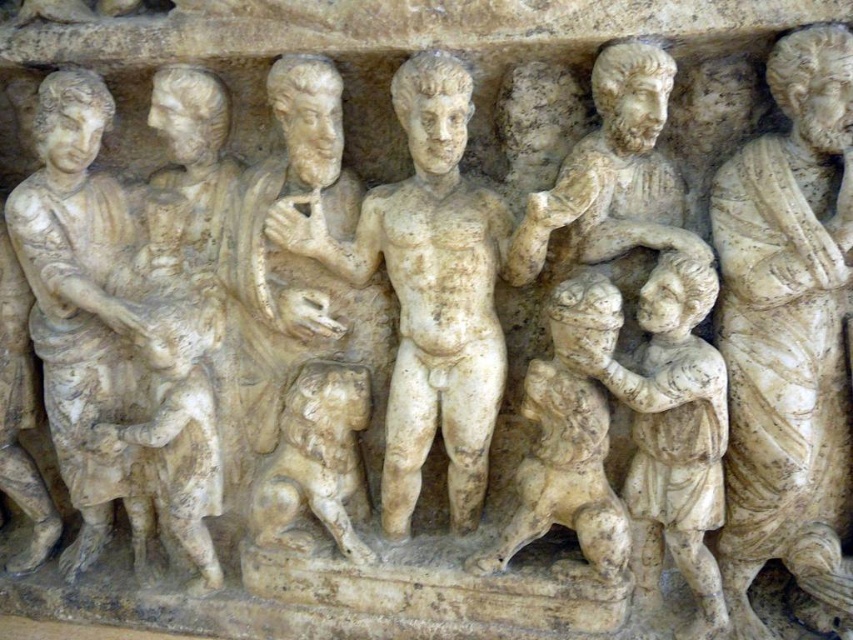
Question: Can you confirm if white marble statue at center is thinner than white marble child at center?

Choices:
 (A) yes
 (B) no

Answer: (B)

Question: Observing the image, what is the correct spatial positioning of white marble statue at center in reference to white marble child at center?

Choices:
 (A) below
 (B) above

Answer: (B)

Question: Can you confirm if white marble child at center is smaller than white stone lion at lower left?

Choices:
 (A) yes
 (B) no

Answer: (B)

Question: Considering the real-world distances, which object is farthest from the white stone lion at lower left?

Choices:
 (A) white marble figure at right
 (B) white marble statue at center

Answer: (A)

Question: Among these objects, which one is nearest to the camera?

Choices:
 (A) white marble child at center
 (B) white marble statue at center

Answer: (B)

Question: Which of the following is the farthest from the observer?

Choices:
 (A) white stone lion at lower left
 (B) white marble figure at right
 (C) white marble child at center

Answer: (A)